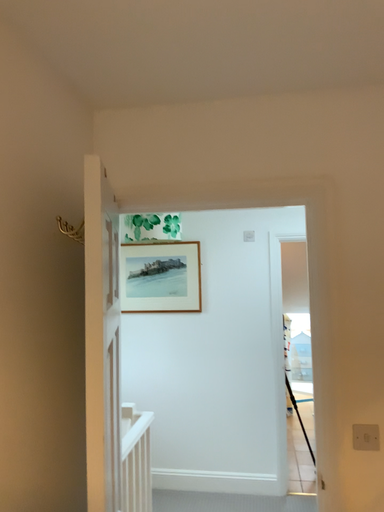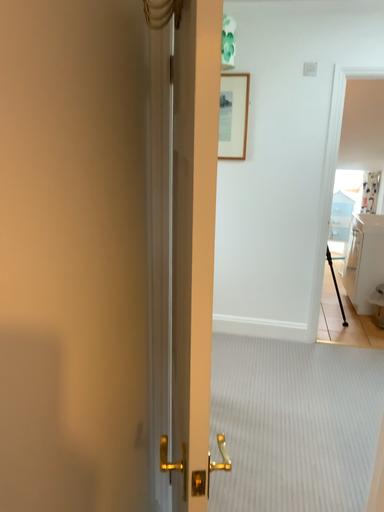
Question: How did the camera likely rotate when shooting the video?

Choices:
 (A) rotated downward
 (B) rotated upward

Answer: (A)